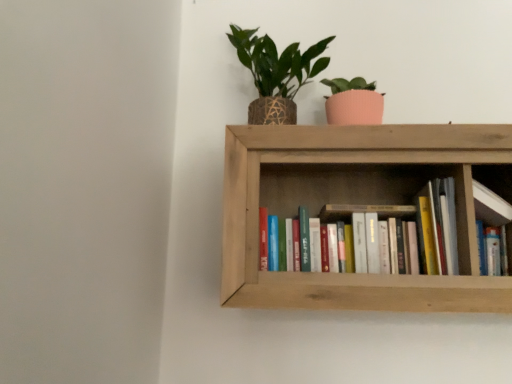
Question: Does point (227, 258) appear closer or farther from the camera than point (489, 180)?

Choices:
 (A) farther
 (B) closer

Answer: (B)

Question: Looking at their shapes, would you say wooden bookshelf at center is wider or thinner than wooden bookshelf at upper right?

Choices:
 (A) thin
 (B) wide

Answer: (B)

Question: Which of these objects is positioned farthest from the wooden bookshelf at upper right?

Choices:
 (A) wooden bookshelf at center
 (B) hardcover books at center
 (C) green woven pot at upper center

Answer: (C)

Question: Which object is positioned closest to the green woven pot at upper center?

Choices:
 (A) wooden bookshelf at upper right
 (B) hardcover books at center
 (C) wooden bookshelf at center

Answer: (C)